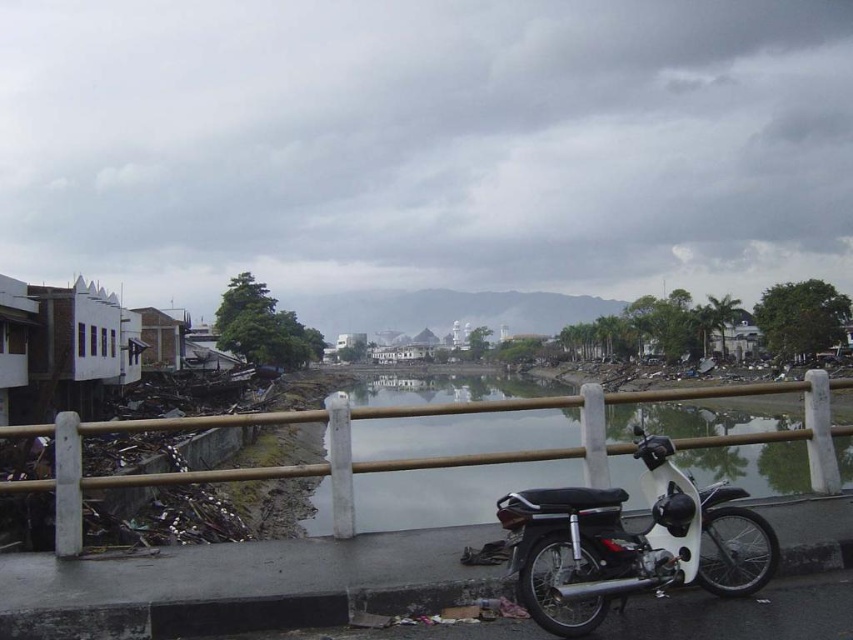
You are standing at the point with coordinates point (602, 602) on the bridge and want to walk to the point with coordinates point (61, 515). Which direction should you face to move towards your destination?

You should face towards the direction of the point (61, 515), which is behind point (602, 602), so you need to walk backwards or turn around to reach it.

You are a delivery person who needs to park your motorcycle in a spot that is not blocked by the white concrete fence at center. Based on the scene, where should you park the white matte motorcycle at lower right?

The white concrete fence at center is bigger than the white matte motorcycle at lower right, so you should park the white matte motorcycle at lower right away from the fence to ensure it is not blocked by the fence.

You are a delivery person who needs to park your white matte motorcycle at lower right near the white concrete fence at center. Can you park it directly next to the fence without moving any other objects?

The white concrete fence at center is to the left of white matte motorcycle at lower right, so you can park the white matte motorcycle at lower right directly next to the white concrete fence at center without moving any other objects.